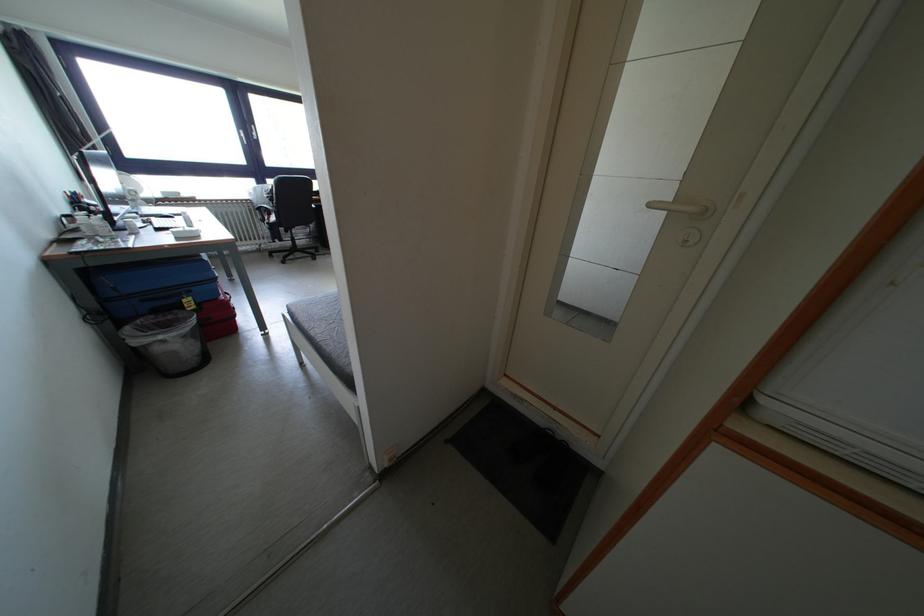
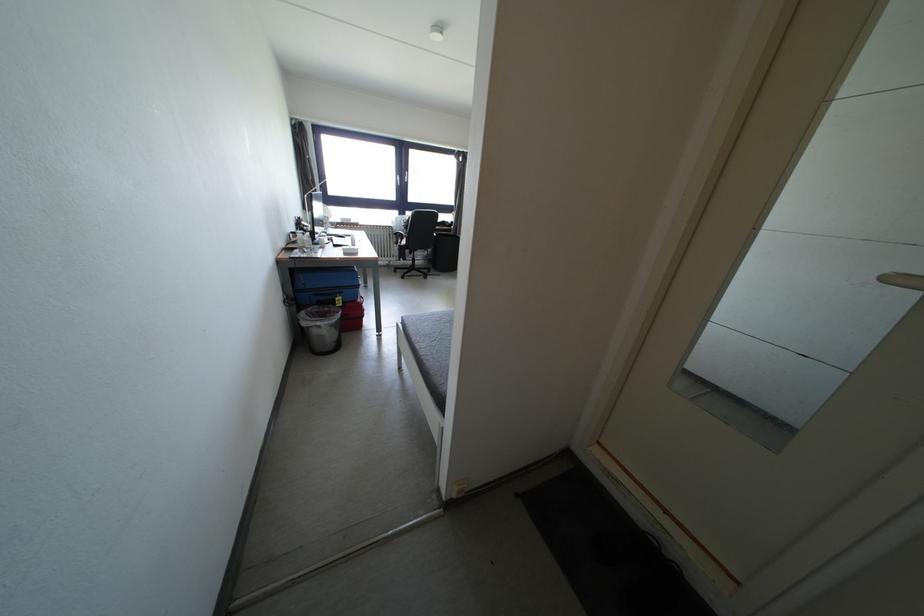
Find the pixel in the second image that matches the point at 261,207 in the first image.

(400, 233)